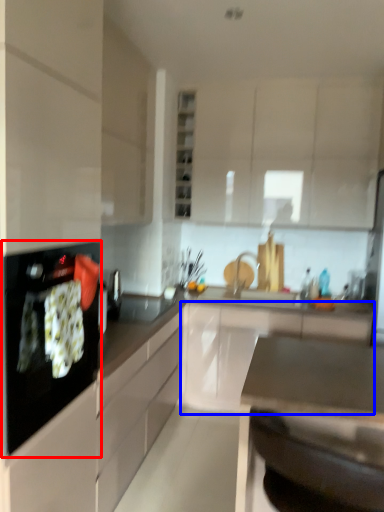
Question: Which of the following is the farthest to the observer, kitchen appliance (highlighted by a red box) or cabinetry (highlighted by a blue box)?

Choices:
 (A) kitchen appliance
 (B) cabinetry

Answer: (B)